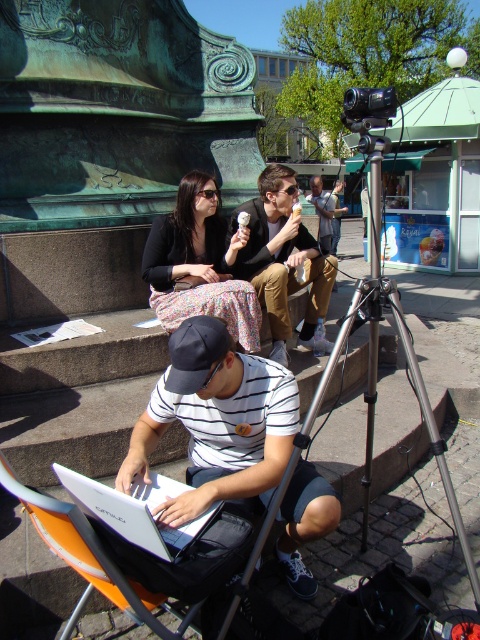
Is silver metallic tripod at center wider than silver metallic laptop at center?

Correct, the width of silver metallic tripod at center exceeds that of silver metallic laptop at center.

Is silver metallic tripod at center smaller than silver metallic laptop at center?

Incorrect, silver metallic tripod at center is not smaller in size than silver metallic laptop at center.

This screenshot has width=480, height=640. What are the coordinates of `silver metallic tripod at center` in the screenshot? It's located at (368, 390).

Which is more to the left, matte brown jacket at center or orange fabric chair at lower left?

orange fabric chair at lower left is more to the left.

Where is `matte brown jacket at center`? The image size is (480, 640). matte brown jacket at center is located at coordinates (x=284, y=260).

Can you confirm if floral skirt at center is smaller than orange fabric chair at lower left?

No.

Can you confirm if floral skirt at center is positioned above orange fabric chair at lower left?

Correct, floral skirt at center is located above orange fabric chair at lower left.

Find the location of a particular element. This screenshot has height=640, width=480. floral skirt at center is located at coordinates (199, 264).